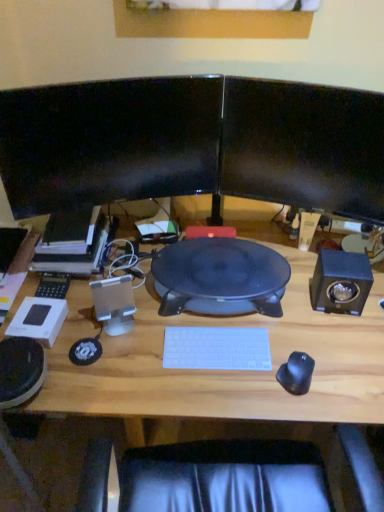
This screenshot has height=512, width=384. I want to click on vacant space in front of white plastic keyboard at center, so click(217, 393).